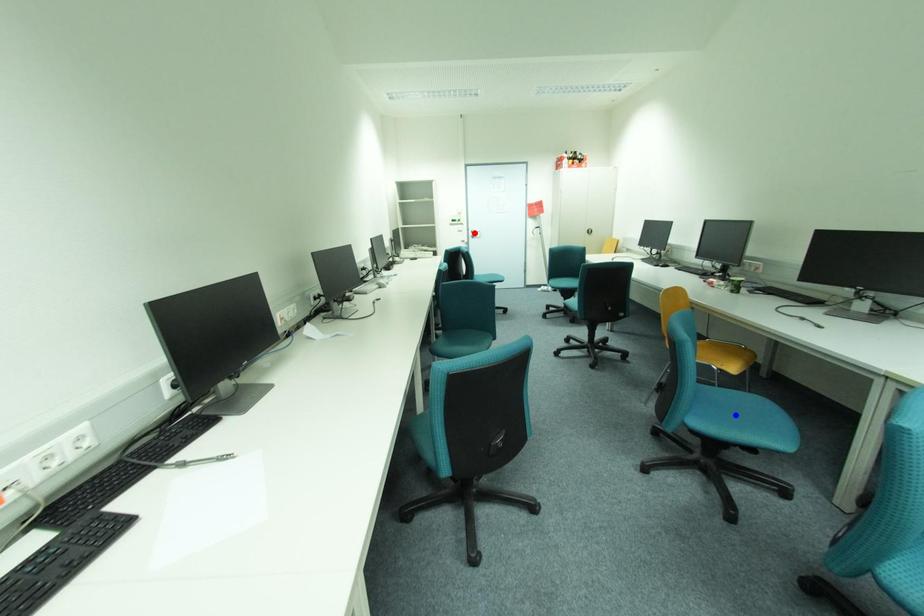
Question: In the image, two points are highlighted. Which point is nearer to the camera? Reply with the corresponding letter.

Choices:
 (A) blue point
 (B) red point

Answer: (A)